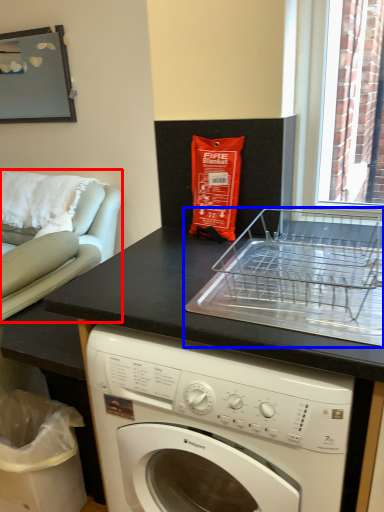
Question: Which object is closer to the camera taking this photo, armchair (highlighted by a red box) or appliance (highlighted by a blue box)?

Choices:
 (A) armchair
 (B) appliance

Answer: (B)